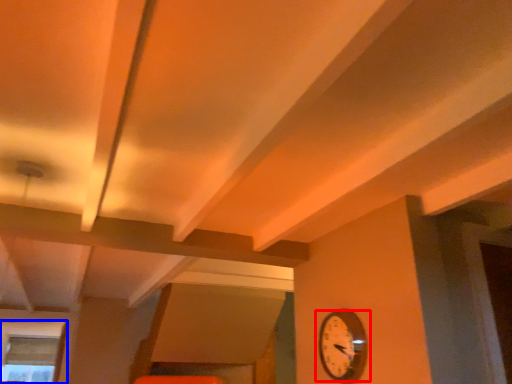
Question: Which object is further to the camera taking this photo, wall clock (highlighted by a red box) or window (highlighted by a blue box)?

Choices:
 (A) wall clock
 (B) window

Answer: (B)